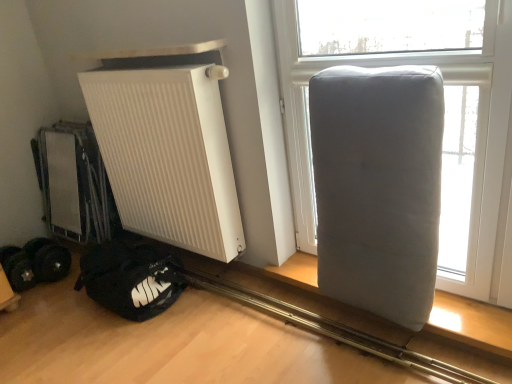
Question: Which is correct: black fabric sleeping bag at lower left is inside gray fabric cushion at right, or outside of it?

Choices:
 (A) inside
 (B) outside

Answer: (B)

Question: Considering the positions of point (139, 271) and point (326, 61), is point (139, 271) closer or farther from the camera than point (326, 61)?

Choices:
 (A) farther
 (B) closer

Answer: (A)

Question: Which is farther from the gray fabric mattress at right?

Choices:
 (A) white matte radiator at left
 (B) gray fabric cushion at right
 (C) black rubber weights at lower left
 (D) black fabric sleeping bag at lower left

Answer: (C)

Question: Estimate the real-world distances between objects in this image. Which object is closer to the white matte radiator at left?

Choices:
 (A) gray fabric mattress at right
 (B) gray fabric cushion at right
 (C) black fabric sleeping bag at lower left
 (D) black rubber weights at lower left

Answer: (C)